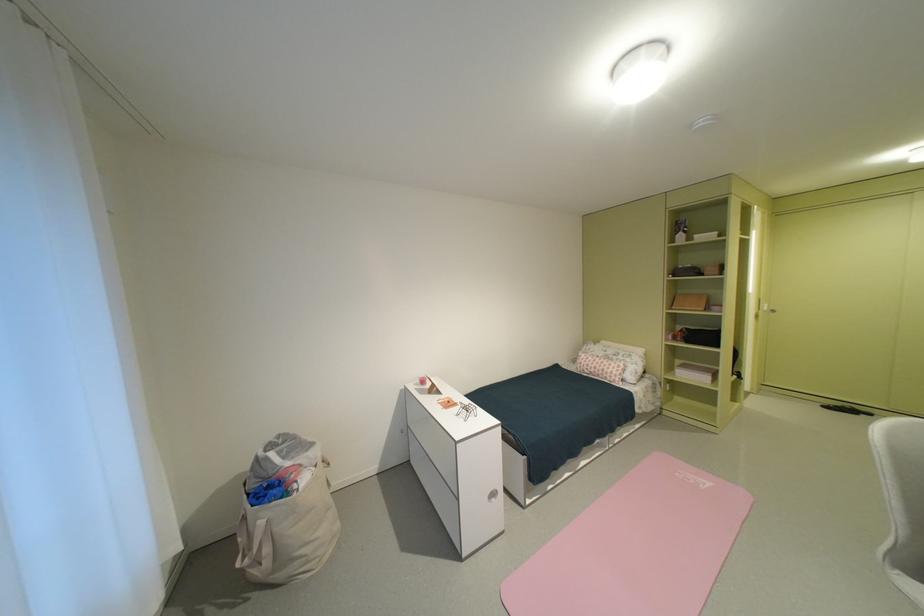
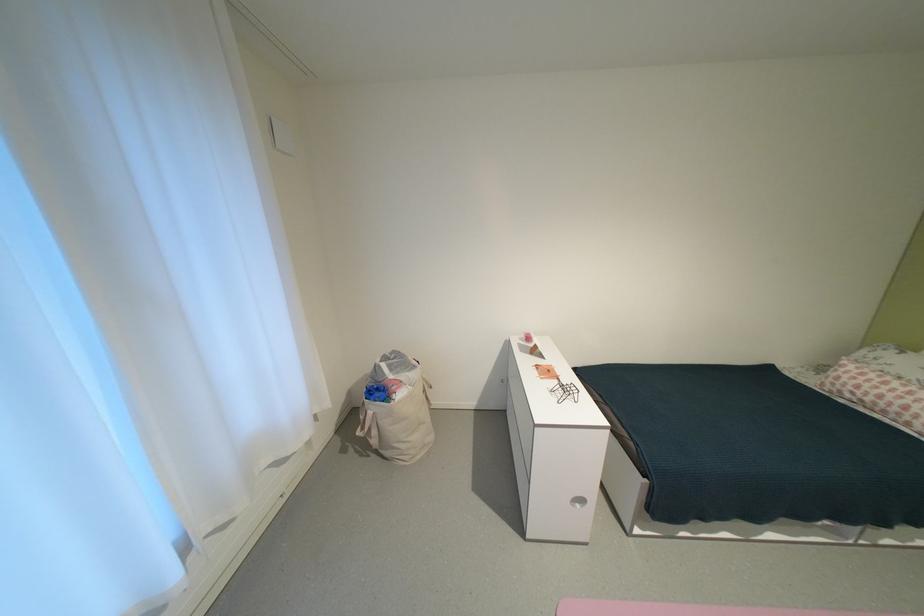
In the second image, find the point that corresponds to point 470,410 in the first image.

(568, 387)